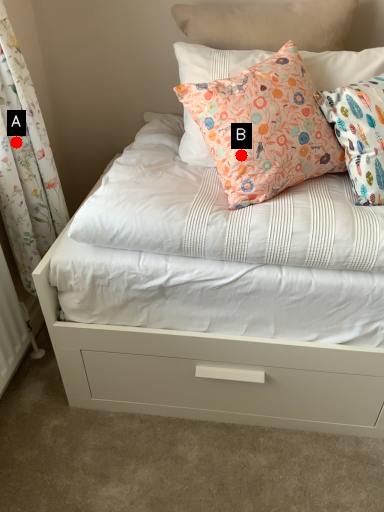
Question: Two points are circled on the image, labeled by A and B beside each circle. Which point is farther from the camera taking this photo?

Choices:
 (A) A is further
 (B) B is further

Answer: (A)